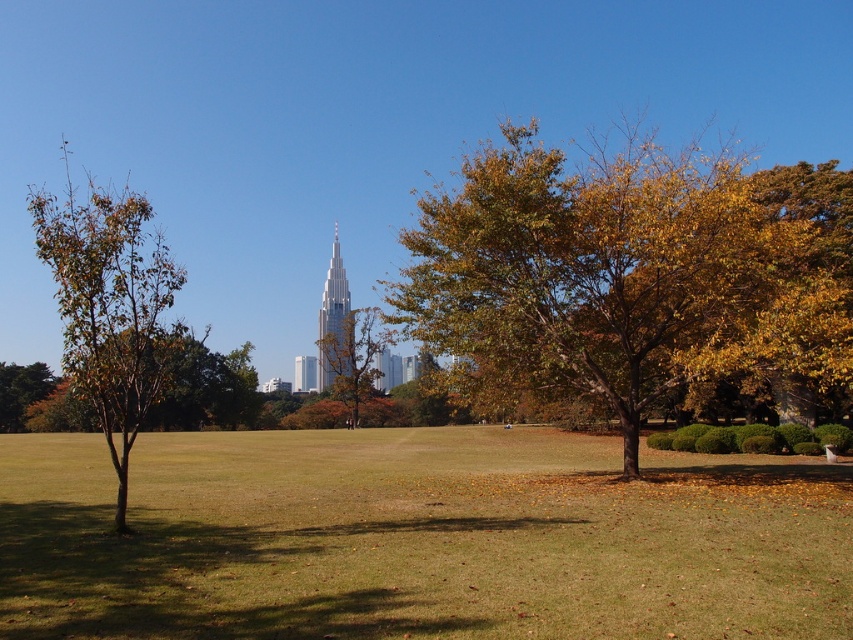
You are a photographer standing at the edge of the green grass at center. You want to take a photo of the autumn leaves tree at center without any obstructions. Can you do that?

The green grass at center is in front of the autumn leaves tree at center, so it will block your view. You need to move to a different position where the green grass at center is not between you and the autumn leaves tree at center.

You are standing in the park and want to place a small bench between the two points, point (479, 525) and point (354, 344). Since you want the bench to be as close as possible to the larger tree with vibrant leaves, which point should you place it closer to?

The bench should be placed closer to point (479, 525) because it is closer to the viewer than point (354, 344), and the larger tree with vibrant leaves is likely in the foreground where the bench would be nearer.